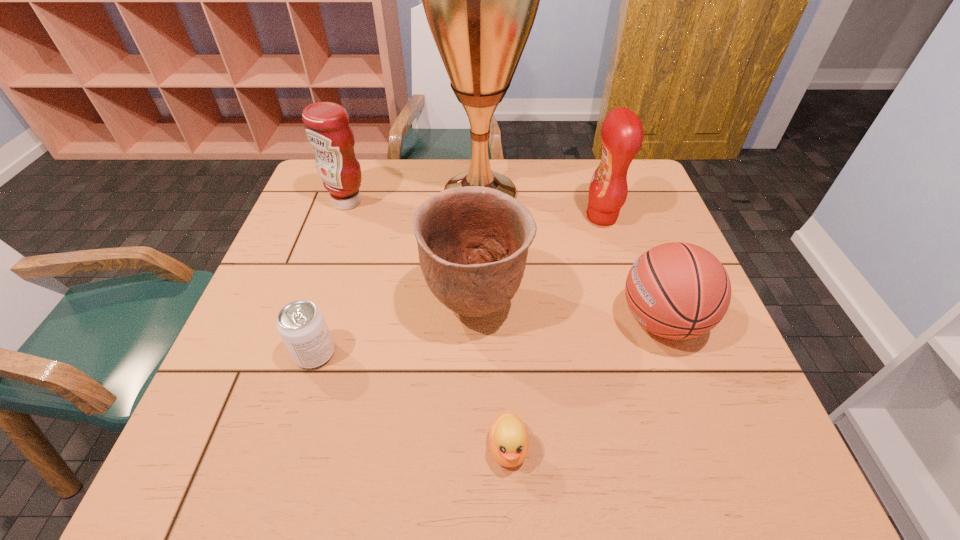
At what (x,y) coordinates should I click in order to perform the action: click on free region at the far right corner of the desktop. Please return your answer as a coordinate pair (x, y). The image size is (960, 540). Looking at the image, I should click on (631, 167).

I want to click on free location at the near right corner, so click(728, 474).

Where is `free space between the tallest object and the nearest object`? free space between the tallest object and the nearest object is located at coordinates (494, 320).

This screenshot has width=960, height=540. In order to click on vacant space that is in between the pottery and the right condiment in this screenshot , I will do `click(539, 261)`.

Find the location of `free spot between the tallest object and the soda can`. free spot between the tallest object and the soda can is located at coordinates (397, 273).

The height and width of the screenshot is (540, 960). Identify the location of vacant space that is in between the pottery and the nearest object. (492, 377).

I want to click on vacant point located between the soda can and the tallest object, so click(x=397, y=273).

At what (x,y) coordinates should I click in order to perform the action: click on unoccupied position between the sixth tallest object and the pottery. Please return your answer as a coordinate pair (x, y). The width and height of the screenshot is (960, 540). Looking at the image, I should click on (396, 330).

Image resolution: width=960 pixels, height=540 pixels. I want to click on free space that is in between the basketball and the duckling, so click(586, 384).

Image resolution: width=960 pixels, height=540 pixels. I want to click on vacant area that lies between the left condiment and the nearest object, so click(428, 325).